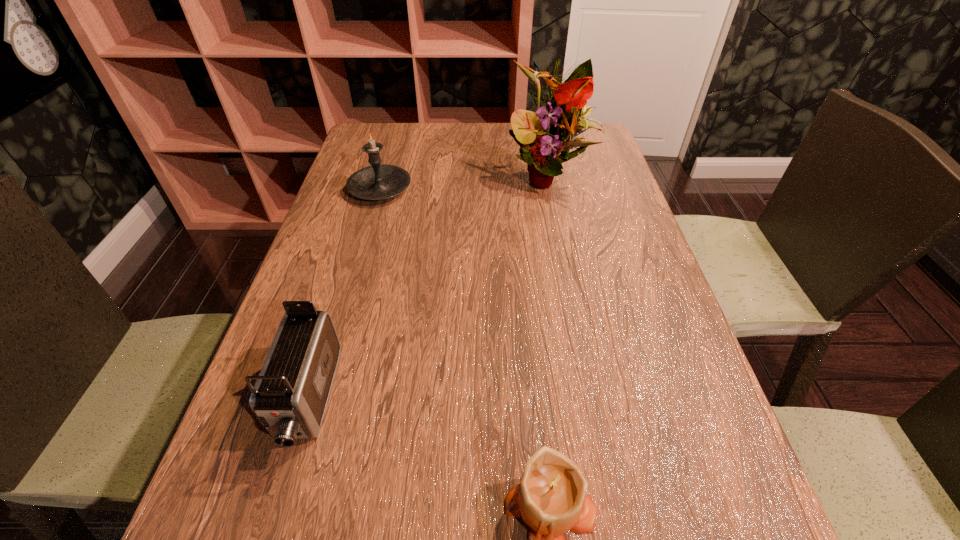
Where is `the tallest object`? the tallest object is located at coordinates (541, 140).

This screenshot has height=540, width=960. I want to click on the taller candle, so click(376, 182).

Locate an element on the screen. The height and width of the screenshot is (540, 960). the farther candle is located at coordinates (376, 182).

At what (x,y) coordinates should I click in order to perform the action: click on camcorder. Please return your answer as a coordinate pair (x, y). This screenshot has height=540, width=960. Looking at the image, I should click on (290, 396).

This screenshot has height=540, width=960. In order to click on vacant space situated 0.260m on the front-facing side of the tallest object in this screenshot , I will do `click(567, 276)`.

You are a GUI agent. You are given a task and a screenshot of the screen. Output one action in this format:
    pyautogui.click(x=<x>, y=<y>)
    Task: Click on the vacant space located on the front of the taller candle
    This screenshot has height=540, width=960.
    Given the screenshot: What is the action you would take?
    pyautogui.click(x=348, y=305)

The height and width of the screenshot is (540, 960). I want to click on object at the far edge, so click(541, 140).

What are the coordinates of `candle positioned at the left edge` in the screenshot? It's located at (376, 182).

This screenshot has height=540, width=960. I want to click on camcorder that is positioned at the left edge, so click(x=290, y=396).

Find the location of `object situated at the right edge`. object situated at the right edge is located at coordinates (541, 140).